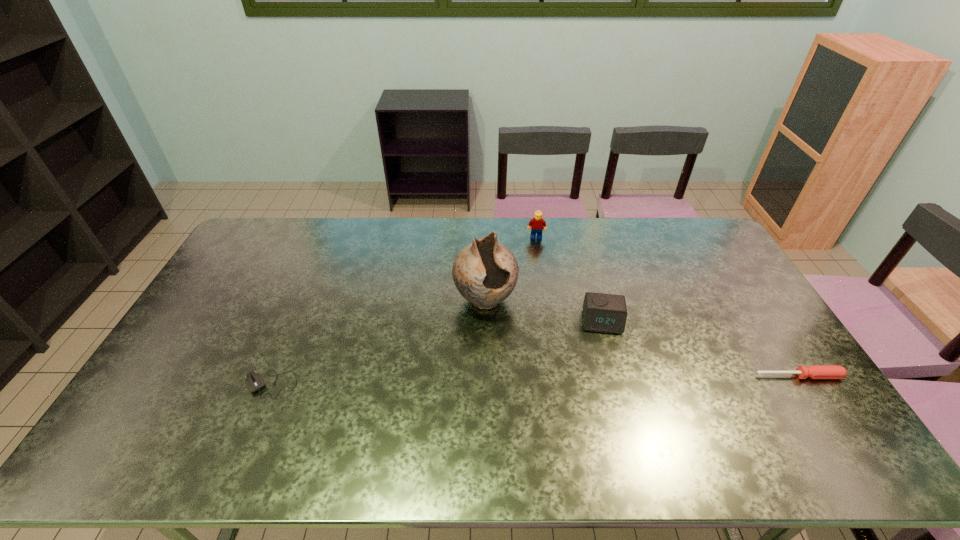
This screenshot has height=540, width=960. In order to click on vacant space that's between the third tallest object and the second tallest object in this screenshot , I will do `click(569, 279)`.

Locate an element on the screen. Image resolution: width=960 pixels, height=540 pixels. empty space between the third shortest object and the second tallest object is located at coordinates 569,279.

Locate an element on the screen. The width and height of the screenshot is (960, 540). free space that is in between the computer mouse and the alarm clock is located at coordinates pyautogui.click(x=436, y=353).

This screenshot has height=540, width=960. Find the location of `free space between the tallest object and the rightmost object`. free space between the tallest object and the rightmost object is located at coordinates (642, 338).

Locate an element on the screen. Image resolution: width=960 pixels, height=540 pixels. vacant space that is in between the rightmost object and the leftmost object is located at coordinates (535, 380).

Find the location of a particular element. free space between the third object from left to right and the screwdriver is located at coordinates (667, 307).

Locate an element on the screen. The height and width of the screenshot is (540, 960). blank region between the alarm clock and the pottery is located at coordinates (543, 310).

Where is `free space between the pottery and the rightmost object`? The image size is (960, 540). free space between the pottery and the rightmost object is located at coordinates (642, 338).

This screenshot has height=540, width=960. Identify the location of free space between the fourth object from left to right and the computer mouse. (436, 353).

The image size is (960, 540). Find the location of `object that is the third closest to the leftmost object`. object that is the third closest to the leftmost object is located at coordinates (536, 224).